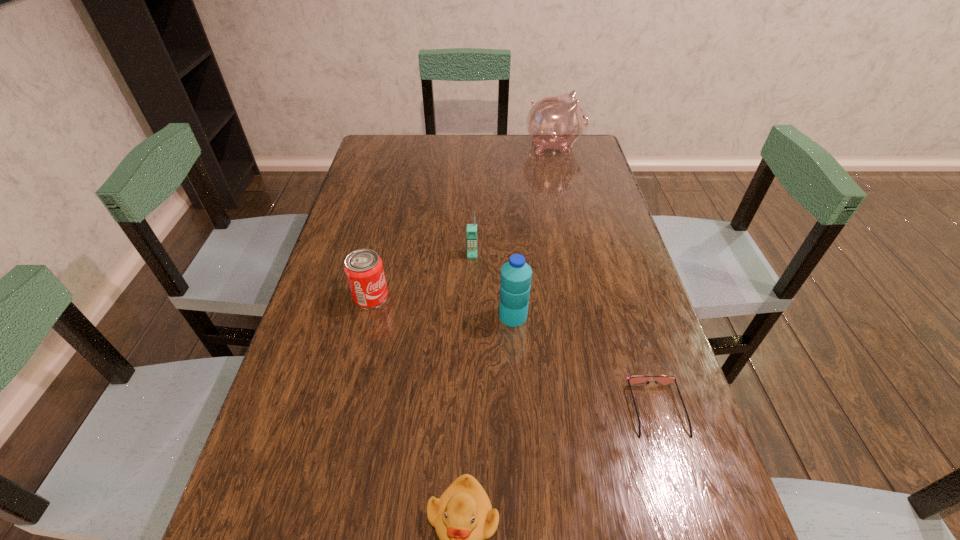
Locate an element on the screen. object that is at the far edge is located at coordinates (555, 122).

This screenshot has width=960, height=540. Identify the location of object that is positioned at the left edge. (364, 270).

Find the location of a particular element. piggy bank that is at the right edge is located at coordinates (555, 122).

Locate an element on the screen. This screenshot has width=960, height=540. sunglasses at the right edge is located at coordinates (664, 380).

I want to click on object present at the far right corner, so click(555, 122).

The width and height of the screenshot is (960, 540). I want to click on vacant space at the far edge of the desktop, so click(501, 134).

Find the location of a particular element. The height and width of the screenshot is (540, 960). vacant region at the left edge of the desktop is located at coordinates (351, 375).

This screenshot has height=540, width=960. In the image, there is a desktop. What are the coordinates of `free space at the right edge` in the screenshot? It's located at (583, 241).

In order to click on free spot at the far left corner of the desktop in this screenshot , I will do `click(369, 146)`.

Where is `free space between the second farthest object and the fourth object from left to right`? free space between the second farthest object and the fourth object from left to right is located at coordinates (492, 285).